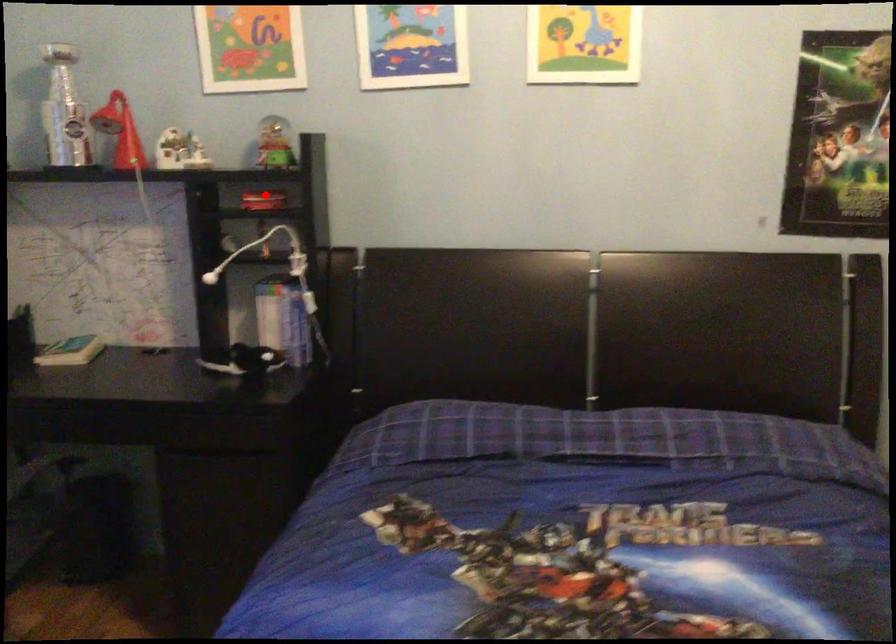
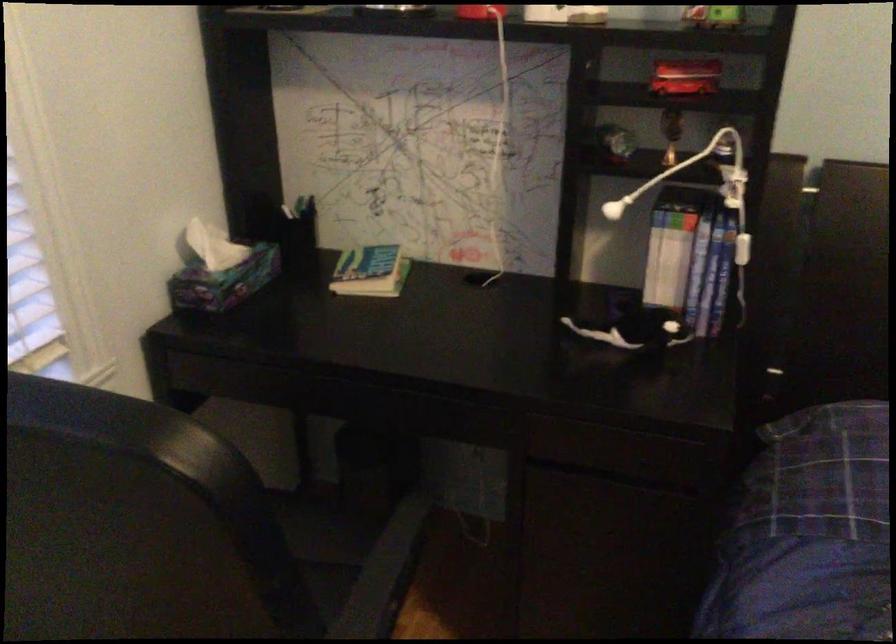
Find the pixel in the second image that matches the highlighted location in the first image.

(685, 77)